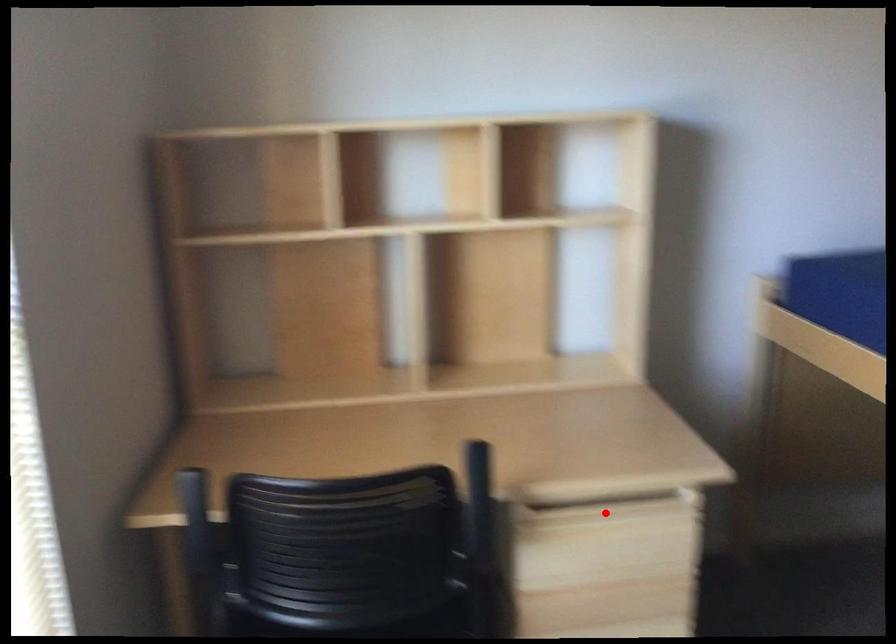
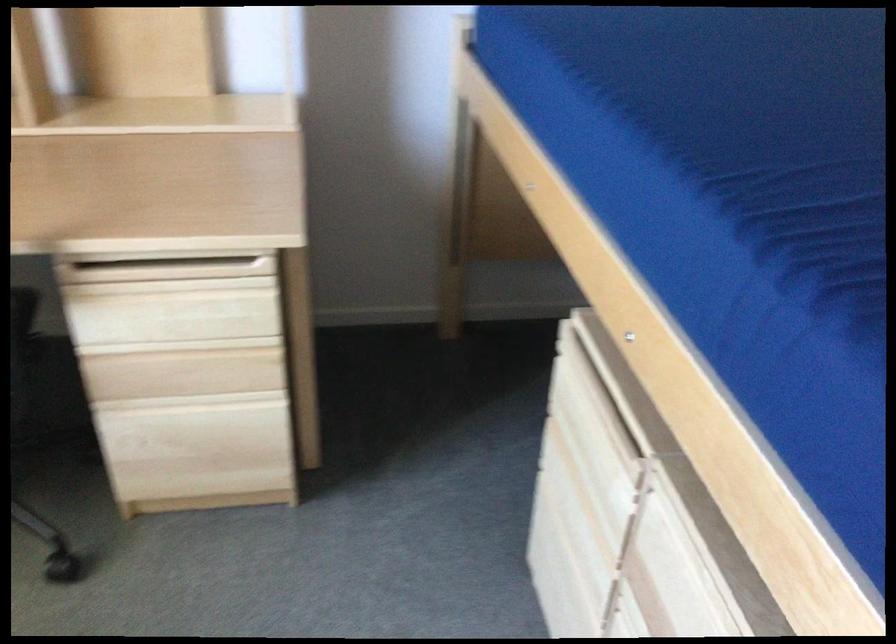
Question: A red point is marked in image1. In image2, is the corresponding 3D point closer to the camera or farther? Reply with the corresponding letter.

Choices:
 (A) The corresponding 3D point is closer.
 (B) The corresponding 3D point is farther.

Answer: (A)